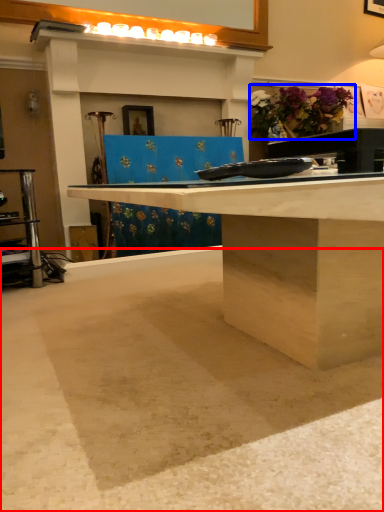
Question: Among these objects, which one is farthest to the camera, concrete (highlighted by a red box) or flower (highlighted by a blue box)?

Choices:
 (A) concrete
 (B) flower

Answer: (B)